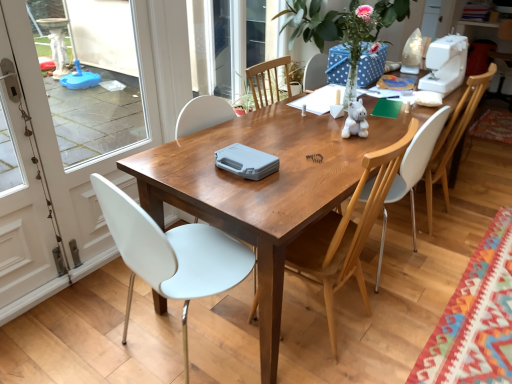
The width and height of the screenshot is (512, 384). Identify the location of vacant location below multicolored woven mat at lower right (from a real-world perspective). (480, 316).